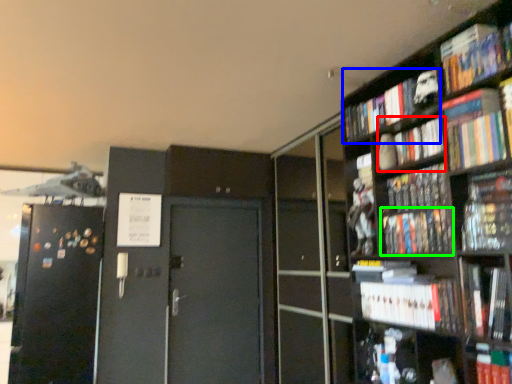
Question: Which object is positioned farthest from book (highlighted by a red box)? Select from book (highlighted by a blue box) and book (highlighted by a green box).

Choices:
 (A) book
 (B) book

Answer: (B)